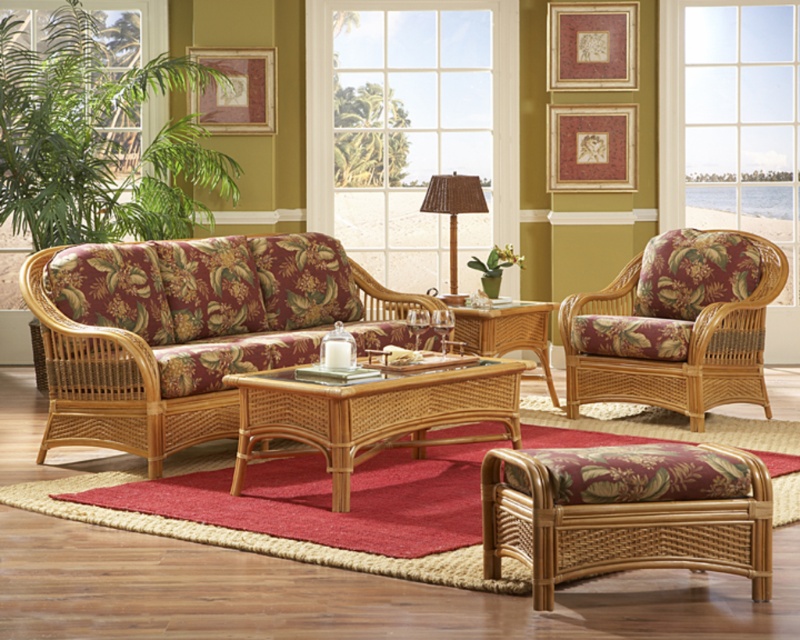
You are sitting on the natural wicker couch at center and want to look outside. Which direction should you turn your head to face the clear glass window at center?

You should turn your head to the right to face the clear glass window at center, as it is located to the right of the natural wicker couch at center.

You are standing in the living room and want to look outside through the transparent glass window at upper center. Where should you look to see the window?

You should look at point 0.191 on the x axis and 0.915 on the y axis to see the transparent glass window at upper center.